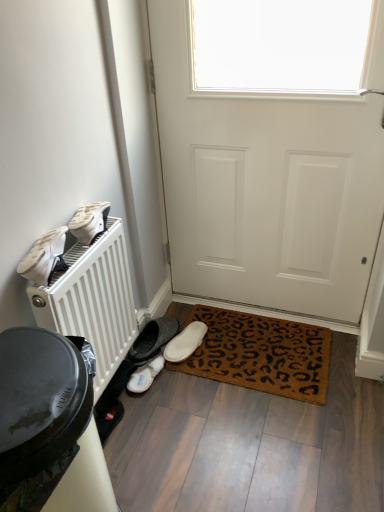
Question: From the image's perspective, is white matte door at center above white suede slipper at lower center, which is the 3th footwear from top to bottom?

Choices:
 (A) no
 (B) yes

Answer: (B)

Question: Is white matte door at center positioned with its back to white suede slipper at lower center, placed as the 4th footwear when sorted from front to back?

Choices:
 (A) no
 (B) yes

Answer: (A)

Question: Considering the relative sizes of white matte door at center and white suede slipper at lower center, placed as the 4th footwear when sorted from front to back, in the image provided, is white matte door at center shorter than white suede slipper at lower center, placed as the 4th footwear when sorted from front to back,?

Choices:
 (A) no
 (B) yes

Answer: (A)

Question: Would you say white matte door at center is a long distance from white suede slipper at lower center, placed as the 4th footwear when sorted from front to back?

Choices:
 (A) yes
 (B) no

Answer: (B)

Question: Is white matte door at center at the right side of white suede slipper at lower center, placed as the 4th footwear when sorted from front to back?

Choices:
 (A) yes
 (B) no

Answer: (A)

Question: From their relative heights in the image, would you say white matte shoe at left, which appears as the second footwear when viewed from the front, is taller or shorter than white fluffy slippers at lower center, which appears as the second footwear when viewed from the back?

Choices:
 (A) tall
 (B) short

Answer: (A)

Question: Considering the positions of point coord(86,226) and point coord(158,370), is point coord(86,226) closer or farther from the camera than point coord(158,370)?

Choices:
 (A) closer
 (B) farther

Answer: (A)

Question: From the image's perspective, is white matte shoe at left, which is the 4th footwear in bottom-to-top order, above or below white fluffy slippers at lower center, acting as the fourth footwear starting from the top?

Choices:
 (A) below
 (B) above

Answer: (B)

Question: Considering their positions, is white matte shoe at left, which appears as the second footwear when viewed from the front, located in front of or behind white fluffy slippers at lower center, which appears as the second footwear when viewed from the back?

Choices:
 (A) behind
 (B) front

Answer: (B)

Question: From a real-world perspective, is white plastic radiator at left above or below white fluffy slippers at lower center, which appears as the first footwear when ordered from the bottom?

Choices:
 (A) above
 (B) below

Answer: (A)

Question: Looking at their shapes, would you say white plastic radiator at left is wider or thinner than white fluffy slippers at lower center, acting as the fourth footwear starting from the top?

Choices:
 (A) wide
 (B) thin

Answer: (A)

Question: Does point (109, 317) appear closer or farther from the camera than point (129, 389)?

Choices:
 (A) closer
 (B) farther

Answer: (A)

Question: In the image, is white plastic radiator at left positioned in front of or behind white fluffy slippers at lower center, which appears as the second footwear when viewed from the back?

Choices:
 (A) front
 (B) behind

Answer: (A)

Question: Is white suede shoes at left, which is the 4th footwear from back to front, situated inside white fluffy slippers at lower center, which appears as the second footwear when viewed from the back, or outside?

Choices:
 (A) outside
 (B) inside

Answer: (A)

Question: Considering the positions of white suede shoes at left, which is the first footwear from front to back, and white fluffy slippers at lower center, which appears as the second footwear when viewed from the back, in the image, is white suede shoes at left, which is the first footwear from front to back, taller or shorter than white fluffy slippers at lower center, which appears as the second footwear when viewed from the back,?

Choices:
 (A) short
 (B) tall

Answer: (B)